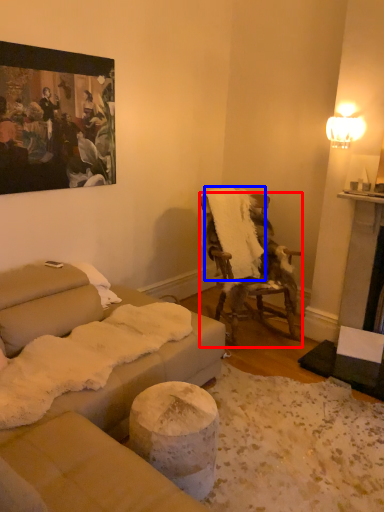
Question: Which point is closer to the camera, chair (highlighted by a red box) or blanket (highlighted by a blue box)?

Choices:
 (A) chair
 (B) blanket

Answer: (A)